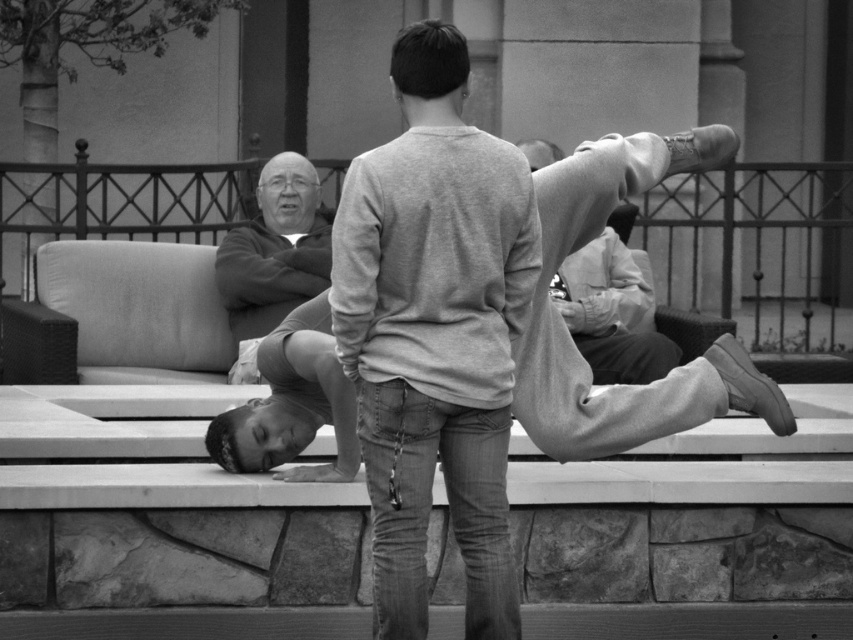
Does point (265, 212) come behind point (595, 259)?

No, (265, 212) is in front of (595, 259).

Which is in front, point (300, 224) or point (610, 273)?

Point (300, 224) is more forward.

Who is more forward, (259,216) or (622,346)?

Point (622,346)

Locate an element on the screen. smooth gray sweater at upper center is located at coordinates (276, 248).